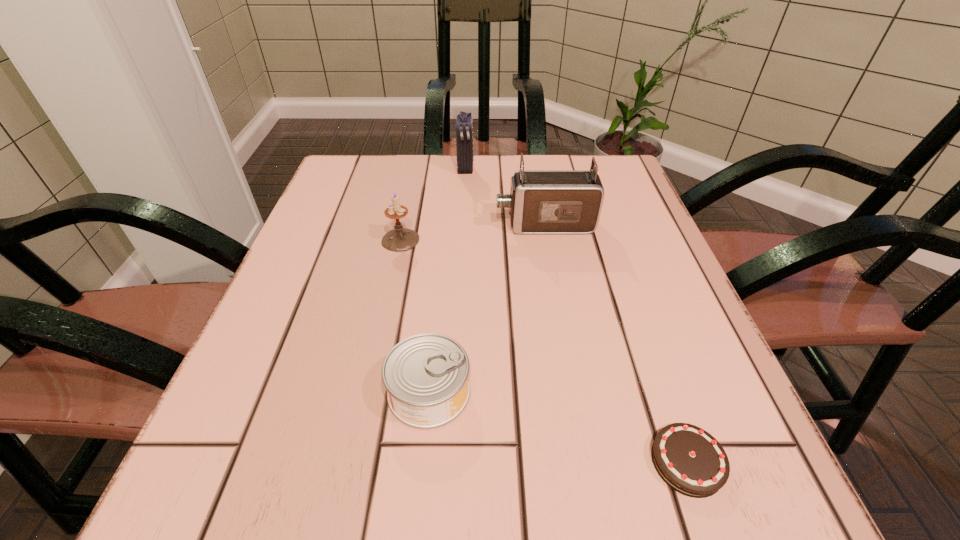
Find the location of a particular element. vacant space at the right edge of the desktop is located at coordinates (671, 337).

Find the location of a particular element. The width and height of the screenshot is (960, 540). vacant space at the far left corner is located at coordinates (326, 194).

The image size is (960, 540). I want to click on free space at the near left corner, so click(294, 511).

This screenshot has width=960, height=540. In the image, there is a desktop. What are the coordinates of `vacant space at the far right corner` in the screenshot? It's located at (562, 155).

Where is `free space between the clutch bag and the third shortest object`? This screenshot has width=960, height=540. free space between the clutch bag and the third shortest object is located at coordinates (433, 204).

Locate an element on the screen. Image resolution: width=960 pixels, height=540 pixels. vacant area between the clutch bag and the second shortest object is located at coordinates pos(447,280).

Image resolution: width=960 pixels, height=540 pixels. What are the coordinates of `empty location between the candle holder and the clutch bag` in the screenshot? It's located at (433, 204).

Image resolution: width=960 pixels, height=540 pixels. Find the location of `empty space between the third shortest object and the shortest object`. empty space between the third shortest object and the shortest object is located at coordinates (543, 351).

The image size is (960, 540). What are the coordinates of `vacant area that lies between the can and the camcorder` in the screenshot? It's located at pyautogui.click(x=487, y=308).

You are a GUI agent. You are given a task and a screenshot of the screen. Output one action in this format:
    pyautogui.click(x=<x>, y=<y>)
    Task: Click on the vacant point located between the second shortest object and the clutch bag
    The height and width of the screenshot is (540, 960).
    Given the screenshot: What is the action you would take?
    pyautogui.click(x=447, y=280)